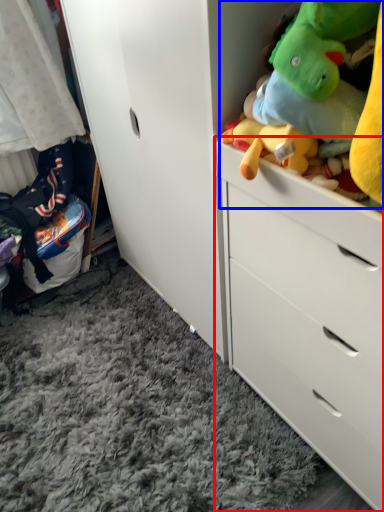
Question: Among these objects, which one is farthest to the camera, chest of drawers (highlighted by a red box) or stuff (highlighted by a blue box)?

Choices:
 (A) chest of drawers
 (B) stuff

Answer: (A)